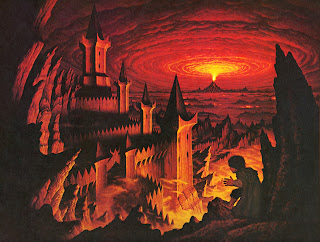
Locate an element on the screen. hood is located at coordinates (249, 170).